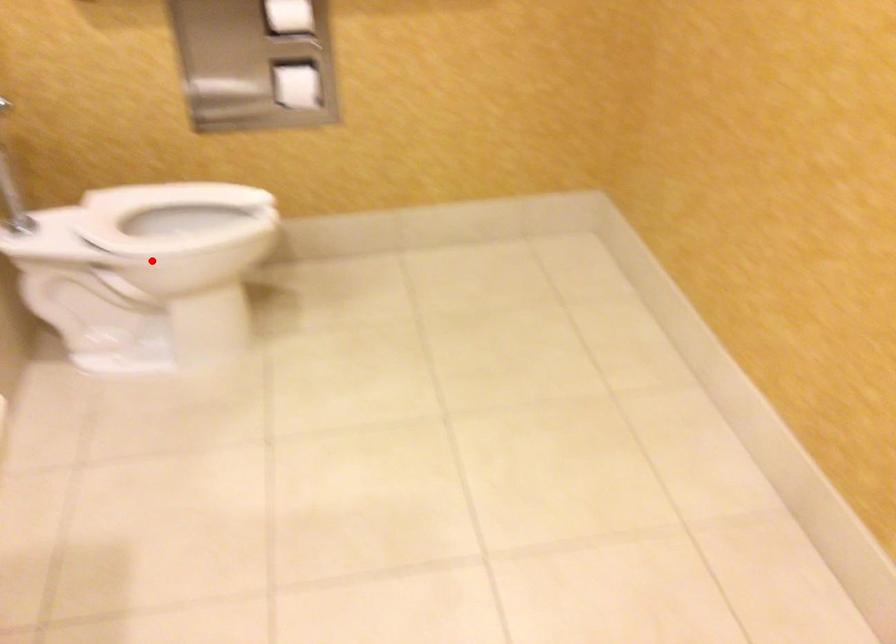
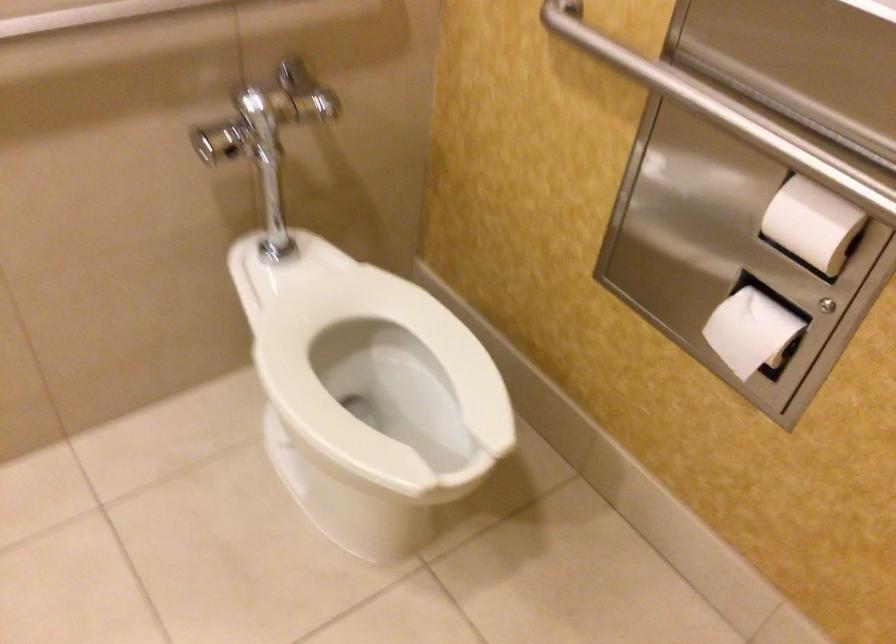
Find the pixel in the second image that matches the highlighted location in the first image.

(380, 381)